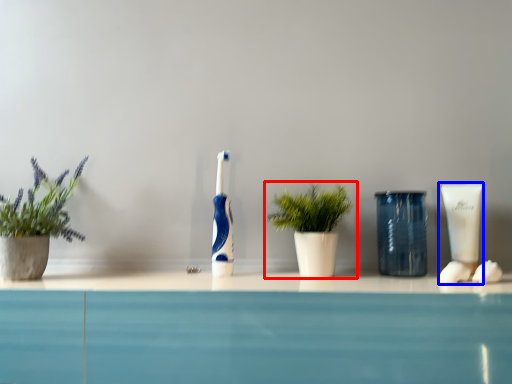
Question: Which of the following is the closest to the observer, houseplant (highlighted by a red box) or toiletry (highlighted by a blue box)?

Choices:
 (A) houseplant
 (B) toiletry

Answer: (A)